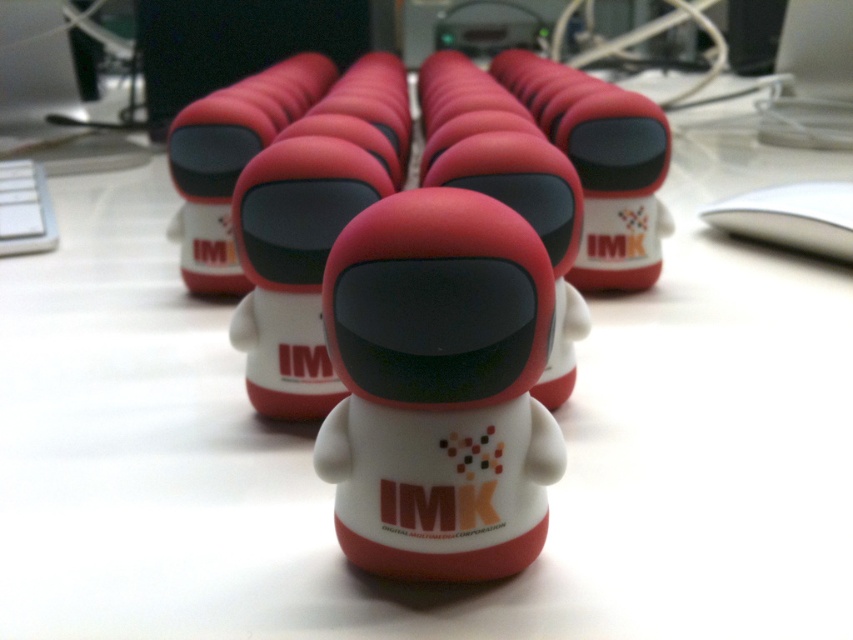
Where is `matte plastic figurine at center`? matte plastic figurine at center is located at coordinates (438, 387).

Is matte plastic toy at center taller than matte white toy at center?

No.

Who is lower down, matte plastic toy at center or matte white toy at center?

matte plastic toy at center is lower down.

Identify the location of matte plastic toy at center. (601, 164).

Find the location of a particular element. This screenshot has height=640, width=853. matte plastic toy at center is located at coordinates [x=601, y=164].

Find the location of a particular element. matte plastic figurine at center is located at coordinates (438, 387).

Is matte plastic figurine at center positioned at the back of white matte robot at center?

No, matte plastic figurine at center is closer to the viewer.

What do you see at coordinates (438, 387) in the screenshot? This screenshot has width=853, height=640. I see `matte plastic figurine at center` at bounding box center [438, 387].

The height and width of the screenshot is (640, 853). In order to click on matte plastic figurine at center in this screenshot , I will do `click(438, 387)`.